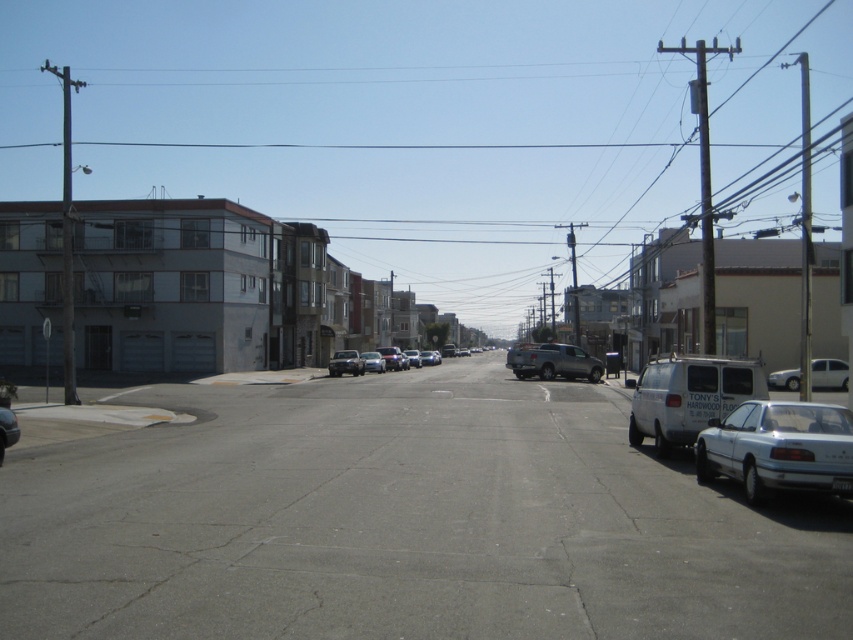
Question: In this image, where is white matte van at lower right located relative to white matte sedan at right?

Choices:
 (A) left
 (B) right

Answer: (A)

Question: Which point is closer to the camera taking this photo?

Choices:
 (A) (694, 428)
 (B) (563, 364)

Answer: (A)

Question: Does metallic silver sedan at center have a lesser width compared to silver metallic sedan at center?

Choices:
 (A) no
 (B) yes

Answer: (A)

Question: Which of these objects is positioned farthest from the white matte van at lower right?

Choices:
 (A) silver metallic sedan at center
 (B) silver metallic sedan at lower right

Answer: (A)

Question: Based on their relative distances, which object is farther from the metallic silver sedan at center?

Choices:
 (A) shiny blue car at lower left
 (B) silver metallic sedan at lower right
 (C) white matte van at lower right

Answer: (B)

Question: Can you confirm if shiny blue car at lower left is thinner than silver metallic sedan at center?

Choices:
 (A) no
 (B) yes

Answer: (A)